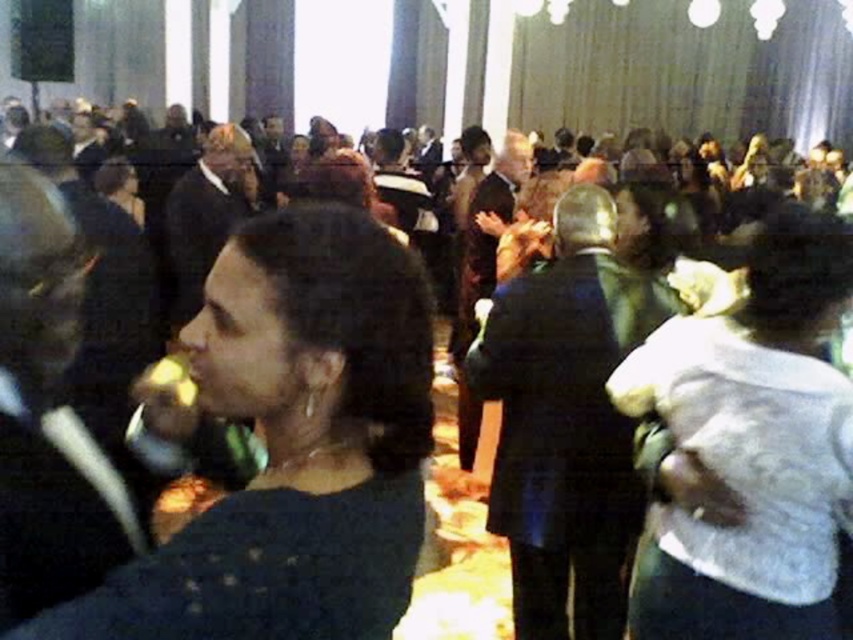
You are an event photographer at the center of the room. You need to capture a photo of both the dark blue sweater at center and the white fabric purse at center. Which object will appear larger in your photo?

The dark blue sweater at center will appear larger in the photo because it is closer to the viewer than the white fabric purse at center.

You are attending a formal event and notice two items at the center of the room. Which item is shorter between the dark blue sweater at center and the white fabric purse at center?

The dark blue sweater at center is shorter than the white fabric purse at center.